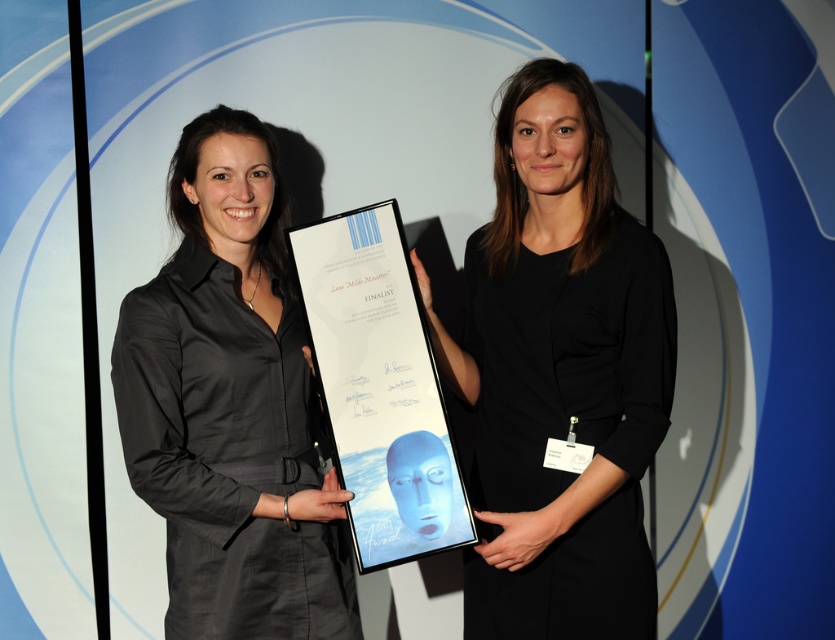
Question: Is black matte dress at center bigger than white glossy plaque at center?

Choices:
 (A) no
 (B) yes

Answer: (B)

Question: Is black matte dress at center positioned before white glossy plaque at center?

Choices:
 (A) yes
 (B) no

Answer: (A)

Question: Where is matte black dress at center located in relation to white glossy plaque at center in the image?

Choices:
 (A) above
 (B) below

Answer: (B)

Question: Considering the real-world distances, which object is farthest from the matte black dress at center?

Choices:
 (A) white glossy plaque at center
 (B) black matte dress at center

Answer: (B)

Question: Which point is farther to the camera?

Choices:
 (A) matte black dress at center
 (B) black matte dress at center

Answer: (A)

Question: Which of the following is the farthest from the observer?

Choices:
 (A) (360, 353)
 (B) (200, 442)
 (C) (649, 429)

Answer: (A)